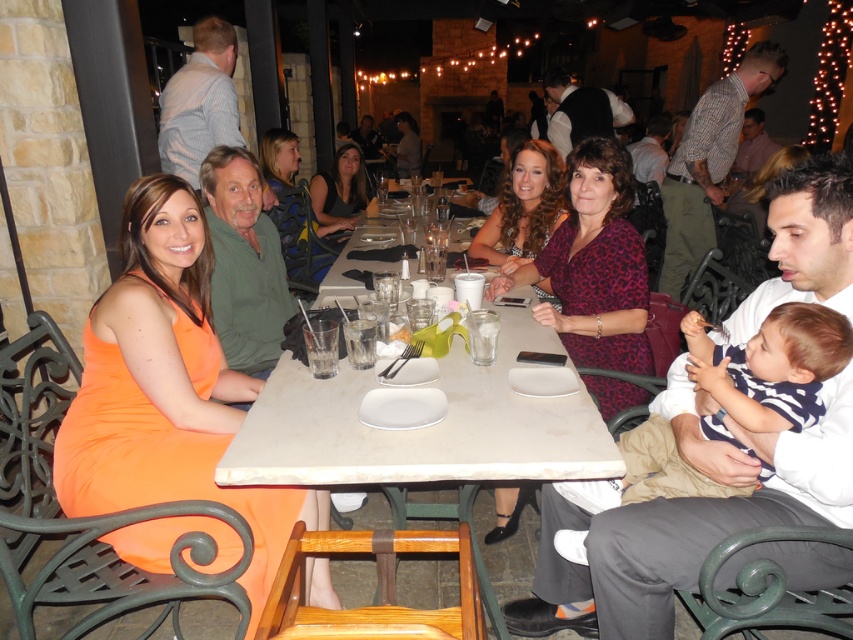
Is point (303, 476) farther from camera compared to point (523, 144)?

No, it is not.

Is white marble table at center smaller than shiny brown hair at center?

Actually, white marble table at center might be larger than shiny brown hair at center.

Which is behind, point (351, 468) or point (527, 234)?

Point (527, 234)

This screenshot has width=853, height=640. I want to click on white marble table at center, so click(422, 428).

In the scene shown: Who is more forward, [122,225] or [546,243]?

Point [122,225] is in front.

What do you see at coordinates (166, 388) in the screenshot? I see `orange satin dress at left` at bounding box center [166, 388].

In order to click on orange satin dress at left in this screenshot , I will do `click(166, 388)`.

Image resolution: width=853 pixels, height=640 pixels. What are the coordinates of `orange satin dress at left` in the screenshot? It's located at (166, 388).

Does white marble table at center have a greater width compared to striped cotton shirt at lower right?

Indeed, white marble table at center has a greater width compared to striped cotton shirt at lower right.

Locate an element on the screen. white marble table at center is located at coordinates (422, 428).

Which is behind, point (276, 404) or point (747, 404)?

Positioned behind is point (276, 404).

Locate an element on the screen. This screenshot has height=640, width=853. white marble table at center is located at coordinates (422, 428).